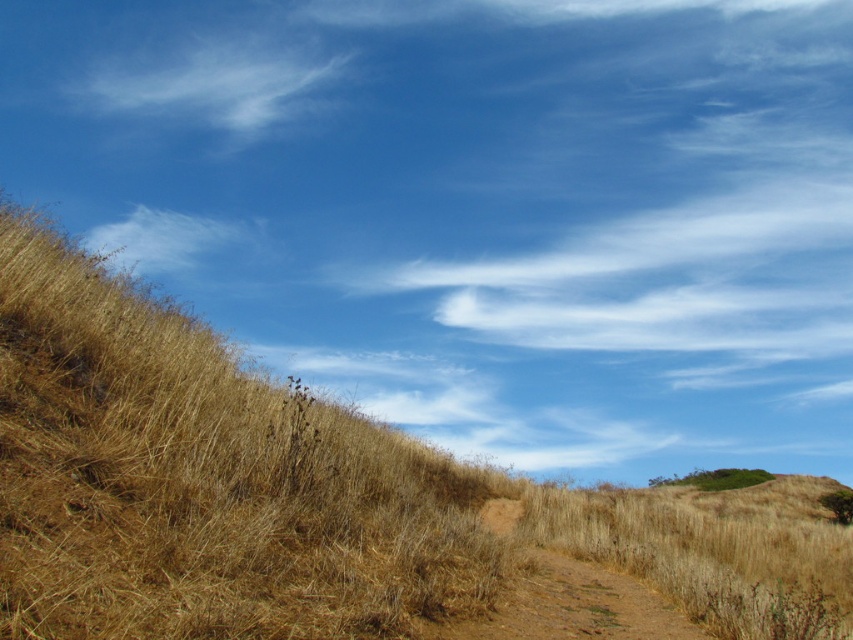
Question: Can you confirm if dry grass at upper left is positioned below white cotton cloud at upper center?

Choices:
 (A) yes
 (B) no

Answer: (A)

Question: Can you confirm if dry grass at upper left is positioned above white cotton cloud at upper center?

Choices:
 (A) yes
 (B) no

Answer: (B)

Question: Which of the following is the closest to the observer?

Choices:
 (A) white cotton cloud at upper center
 (B) dry grass at upper left

Answer: (B)

Question: Is dry grass at upper left positioned before white cotton cloud at upper center?

Choices:
 (A) no
 (B) yes

Answer: (B)